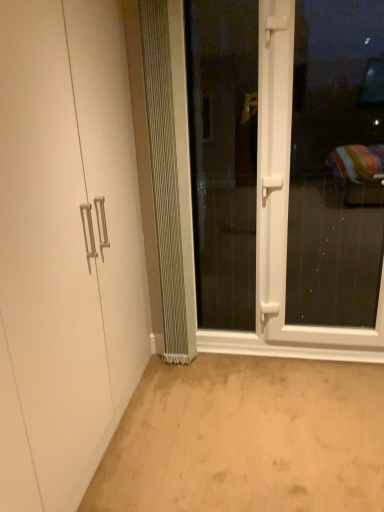
Question: Would you say beige carpet at lower center is inside or outside clear glass screen door at center, which ranks as the 1th screen door in left-to-right order?

Choices:
 (A) outside
 (B) inside

Answer: (A)

Question: From a real-world perspective, is beige carpet at lower center positioned above or below clear glass screen door at center, which is the 2th screen door in right-to-left order?

Choices:
 (A) below
 (B) above

Answer: (A)

Question: Which object is the farthest from the metallic silver radiator at center?

Choices:
 (A) white plastic screen door at center, the 2th screen door from the left
 (B) white matte cabinet at left
 (C) beige carpet at lower center
 (D) clear glass screen door at center, which is the 2th screen door in right-to-left order

Answer: (C)

Question: Estimate the real-world distances between objects in this image. Which object is closer to the white plastic screen door at center, the 2th screen door from the left?

Choices:
 (A) clear glass screen door at center, which ranks as the 1th screen door in left-to-right order
 (B) white matte cabinet at left
 (C) metallic silver radiator at center
 (D) beige carpet at lower center

Answer: (C)